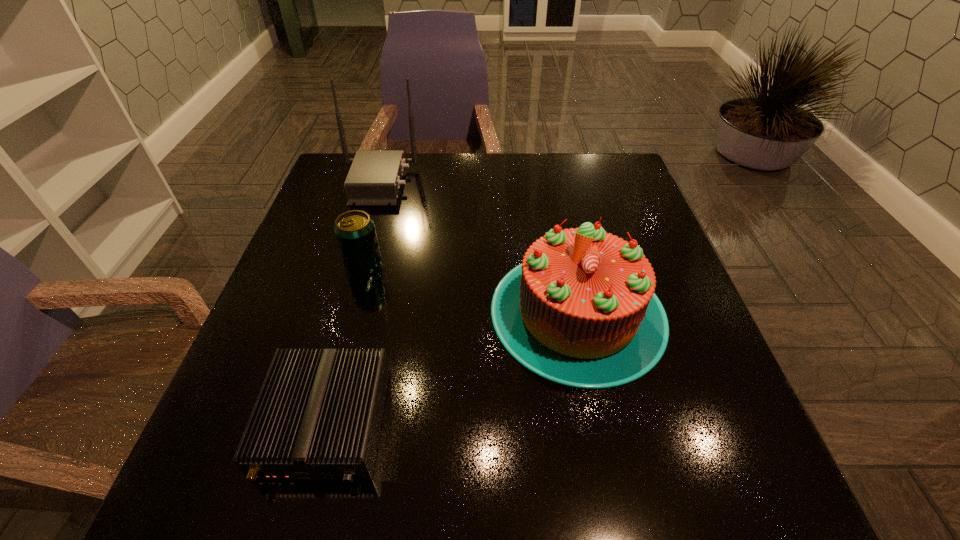
Where is `object that is positioned at the far edge`? This screenshot has width=960, height=540. object that is positioned at the far edge is located at coordinates (374, 179).

The height and width of the screenshot is (540, 960). In order to click on object located in the near edge section of the desktop in this screenshot , I will do `click(318, 415)`.

Find the location of a particular element. beer can that is at the left edge is located at coordinates (355, 232).

The height and width of the screenshot is (540, 960). Find the location of `object that is at the right edge`. object that is at the right edge is located at coordinates (580, 310).

What are the coordinates of `object that is positioned at the far left corner` in the screenshot? It's located at (374, 179).

Where is `object at the near left corner`? object at the near left corner is located at coordinates (318, 415).

At what (x,y) coordinates should I click in order to perform the action: click on vacant area at the far edge. Please return your answer as a coordinate pair (x, y). Image resolution: width=960 pixels, height=540 pixels. Looking at the image, I should click on (439, 193).

I want to click on free space at the left edge of the desktop, so click(x=318, y=321).

Locate an element on the screen. This screenshot has height=540, width=960. vacant space at the right edge of the desktop is located at coordinates (714, 356).

In the image, there is a desktop. Identify the location of free space at the far right corner. Image resolution: width=960 pixels, height=540 pixels. (611, 165).